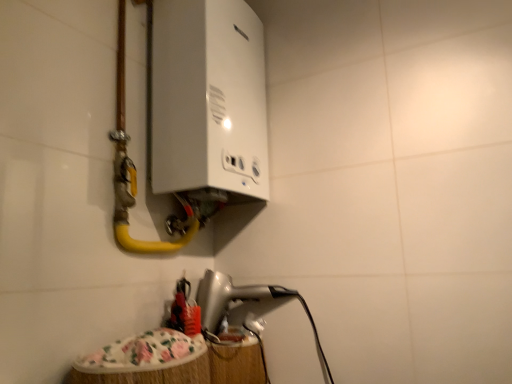
Question: Is white glossy boiler at upper center, the 2th appliance in the bottom-to-top sequence, shorter than silver metallic hairdryer at lower center, which is the first appliance in bottom-to-top order?

Choices:
 (A) no
 (B) yes

Answer: (A)

Question: Is white glossy boiler at upper center, the 2th appliance in the bottom-to-top sequence, positioned far away from silver metallic hairdryer at lower center, which is the first appliance in bottom-to-top order?

Choices:
 (A) yes
 (B) no

Answer: (B)

Question: Is white glossy boiler at upper center, marked as the 1th appliance in a top-to-bottom arrangement, thinner than silver metallic hairdryer at lower center, which is the first appliance in bottom-to-top order?

Choices:
 (A) no
 (B) yes

Answer: (B)

Question: Is white glossy boiler at upper center, marked as the 1th appliance in a top-to-bottom arrangement, at the right side of silver metallic hairdryer at lower center, which is the first appliance in bottom-to-top order?

Choices:
 (A) no
 (B) yes

Answer: (A)

Question: Is white glossy boiler at upper center, marked as the 1th appliance in a top-to-bottom arrangement, not inside silver metallic hairdryer at lower center, which is the first appliance in bottom-to-top order?

Choices:
 (A) yes
 (B) no

Answer: (A)

Question: Is white glossy boiler at upper center, marked as the 1th appliance in a top-to-bottom arrangement, directly adjacent to silver metallic hairdryer at lower center, which appears as the second appliance when viewed from the top?

Choices:
 (A) yes
 (B) no

Answer: (B)

Question: Is silver metallic hairdryer at lower center, which is the first appliance in bottom-to-top order, to the right of yellow rubber hose at upper left from the viewer's perspective?

Choices:
 (A) yes
 (B) no

Answer: (A)

Question: From a real-world perspective, is silver metallic hairdryer at lower center, which appears as the second appliance when viewed from the top, under yellow rubber hose at upper left?

Choices:
 (A) no
 (B) yes

Answer: (B)

Question: Considering the relative sizes of silver metallic hairdryer at lower center, which is the first appliance in bottom-to-top order, and yellow rubber hose at upper left in the image provided, is silver metallic hairdryer at lower center, which is the first appliance in bottom-to-top order, taller than yellow rubber hose at upper left?

Choices:
 (A) no
 (B) yes

Answer: (A)

Question: Is silver metallic hairdryer at lower center, which is the first appliance in bottom-to-top order, facing towards yellow rubber hose at upper left?

Choices:
 (A) no
 (B) yes

Answer: (A)

Question: Is the surface of silver metallic hairdryer at lower center, which is the first appliance in bottom-to-top order, in direct contact with yellow rubber hose at upper left?

Choices:
 (A) no
 (B) yes

Answer: (A)

Question: From the image's perspective, is silver metallic hairdryer at lower center, which appears as the second appliance when viewed from the top, on yellow rubber hose at upper left?

Choices:
 (A) no
 (B) yes

Answer: (A)

Question: Are yellow rubber hose at upper left and white glossy boiler at upper center, the 2th appliance in the bottom-to-top sequence, located far from each other?

Choices:
 (A) no
 (B) yes

Answer: (A)